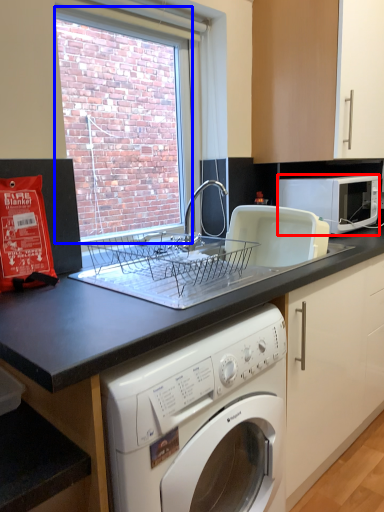
Question: Which point is closer to the camera, microwave oven (highlighted by a red box) or window screen (highlighted by a blue box)?

Choices:
 (A) microwave oven
 (B) window screen

Answer: (B)